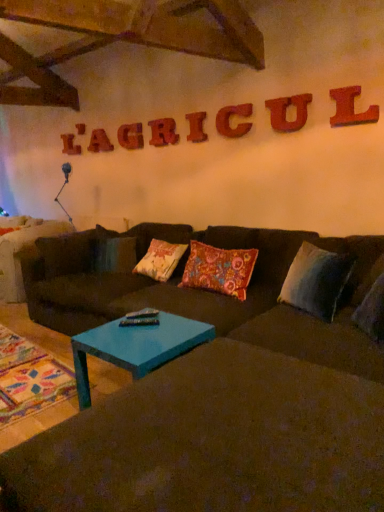
Question: Would you consider gray fabric pillow at right, the first pillow when ordered from right to left, to be distant from teal glossy coffee table at center?

Choices:
 (A) yes
 (B) no

Answer: (B)

Question: From the image's perspective, is gray fabric pillow at right, which appears as the 2th pillow when viewed from the left, below teal glossy coffee table at center?

Choices:
 (A) yes
 (B) no

Answer: (B)

Question: From a real-world perspective, is gray fabric pillow at right, which appears as the 2th pillow when viewed from the left, located beneath teal glossy coffee table at center?

Choices:
 (A) no
 (B) yes

Answer: (A)

Question: From a real-world perspective, is gray fabric pillow at right, which appears as the 2th pillow when viewed from the left, positioned over teal glossy coffee table at center based on gravity?

Choices:
 (A) no
 (B) yes

Answer: (B)

Question: Can you confirm if gray fabric pillow at right, which appears as the 2th pillow when viewed from the left, is shorter than teal glossy coffee table at center?

Choices:
 (A) yes
 (B) no

Answer: (B)

Question: Does gray fabric pillow at right, which appears as the 2th pillow when viewed from the left, appear on the right side of teal glossy coffee table at center?

Choices:
 (A) yes
 (B) no

Answer: (A)

Question: Is gray fabric pillow at right, the first pillow when ordered from right to left, to the left of dark brown fabric couch at center from the viewer's perspective?

Choices:
 (A) no
 (B) yes

Answer: (A)

Question: Can you see gray fabric pillow at right, the first pillow when ordered from right to left, touching dark brown fabric couch at center?

Choices:
 (A) no
 (B) yes

Answer: (A)

Question: Is gray fabric pillow at right, which appears as the 2th pillow when viewed from the left, facing towards dark brown fabric couch at center?

Choices:
 (A) no
 (B) yes

Answer: (B)

Question: From a real-world perspective, is gray fabric pillow at right, the first pillow when ordered from right to left, below dark brown fabric couch at center?

Choices:
 (A) no
 (B) yes

Answer: (A)

Question: Is gray fabric pillow at right, which appears as the 2th pillow when viewed from the left, further to the viewer compared to dark brown fabric couch at center?

Choices:
 (A) yes
 (B) no

Answer: (A)

Question: Does gray fabric pillow at right, the first pillow when ordered from right to left, have a lesser width compared to dark brown fabric couch at center?

Choices:
 (A) no
 (B) yes

Answer: (B)

Question: Is floral-patterned fabric pillow at center, the 1th pillow when ordered from left to right, oriented towards gray fabric pillow at right, the first pillow when ordered from right to left?

Choices:
 (A) no
 (B) yes

Answer: (A)